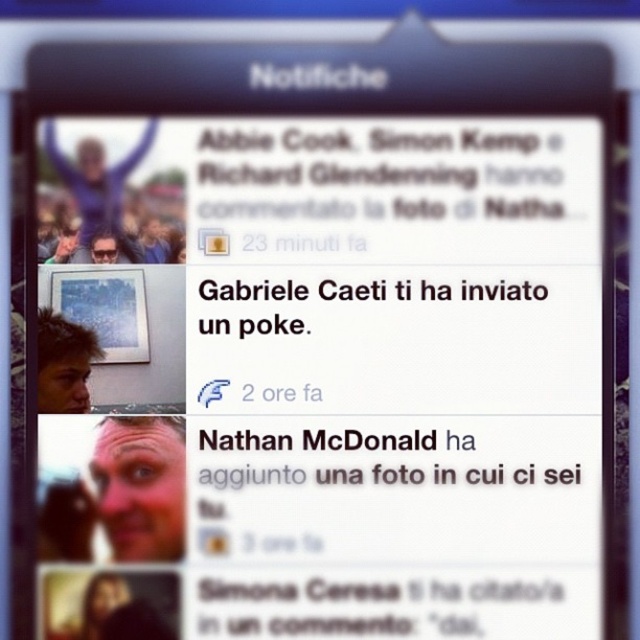
Question: Can you confirm if blonde hair at left is thinner than matte black sunglasses at upper left?

Choices:
 (A) no
 (B) yes

Answer: (A)

Question: Among these points, which one is farthest from the camera?

Choices:
 (A) (58, 408)
 (B) (120, 259)

Answer: (B)

Question: Which object is positioned closest to the matte black sunglasses at upper left?

Choices:
 (A) blurred skin face at lower left
 (B) blonde hair at left

Answer: (B)

Question: Which object is the farthest from the blurred skin face at lower left?

Choices:
 (A) blonde hair at left
 (B) matte black sunglasses at upper left

Answer: (B)

Question: Is blurred skin face at lower left below blonde hair at left?

Choices:
 (A) no
 (B) yes

Answer: (B)

Question: Does blonde hair at left appear under matte black sunglasses at upper left?

Choices:
 (A) yes
 (B) no

Answer: (A)